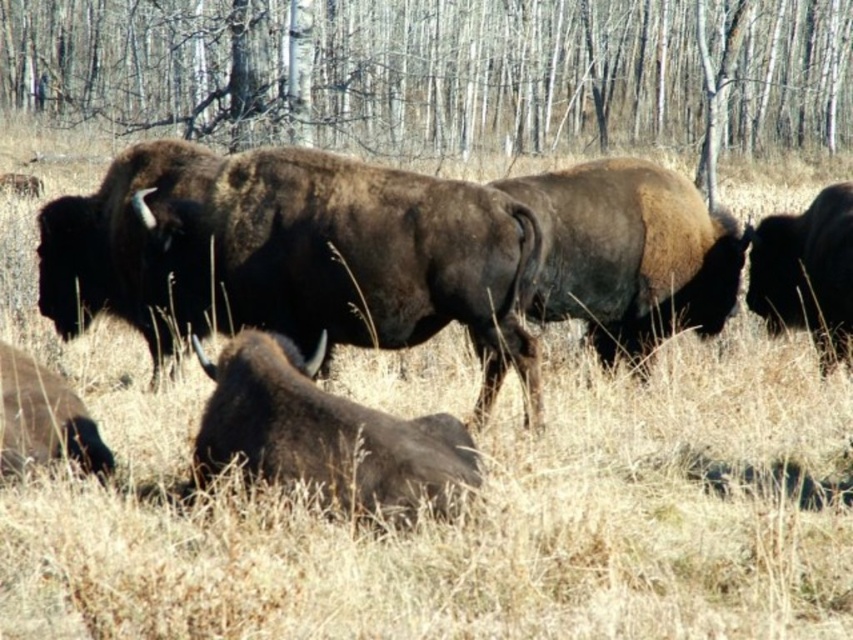
You are a photographer trying to capture a photo of the brown fuzzy bison at center. You notice the bare wood trees at upper center might block the sunlight. Can you determine if the trees will cast a shadow on the bison?

The bare wood trees at upper center are much taller than the brown fuzzy bison at center, so their shadows would likely fall on the bison depending on the sun angle. Since the sun position isn

You are a photographer trying to capture a wide shot of the brown fuzzy bison at center and the bare wood trees at upper center. Based on their sizes in the image, which one would appear larger in your photo?

The bare wood trees at upper center would appear larger in the photo since they are bigger than the brown fuzzy bison at center according to the description.

You are a wildlife photographer aiming to capture a closeup of the brown fuzzy bison at center and the dark brown fur at center. Given that your camera lens can only focus on one subject at a time, which subject should you choose to ensure the larger one is in focus?

The brown fuzzy bison at center is bigger than the dark brown fur at center, so you should focus on the brown fuzzy bison at center to ensure the larger subject is in focus.